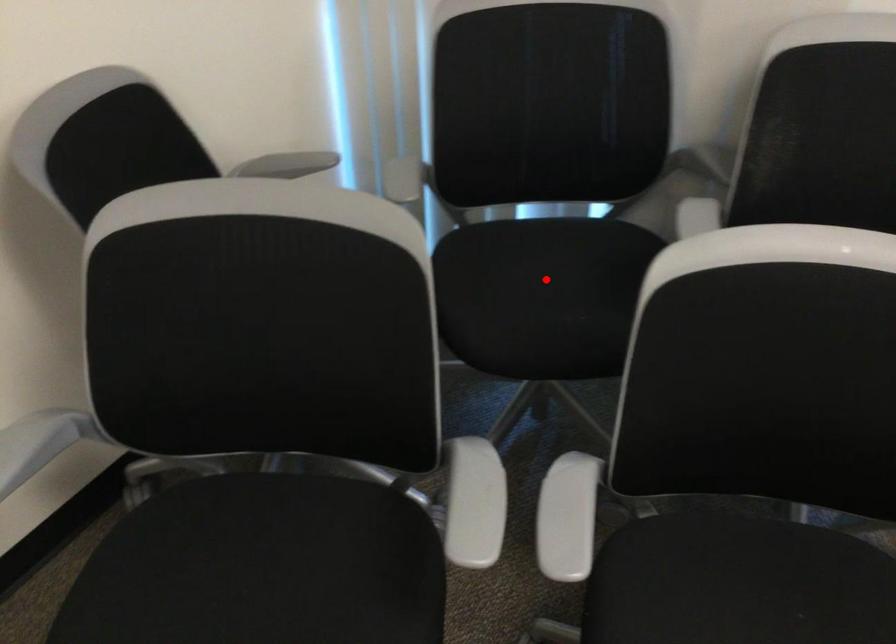
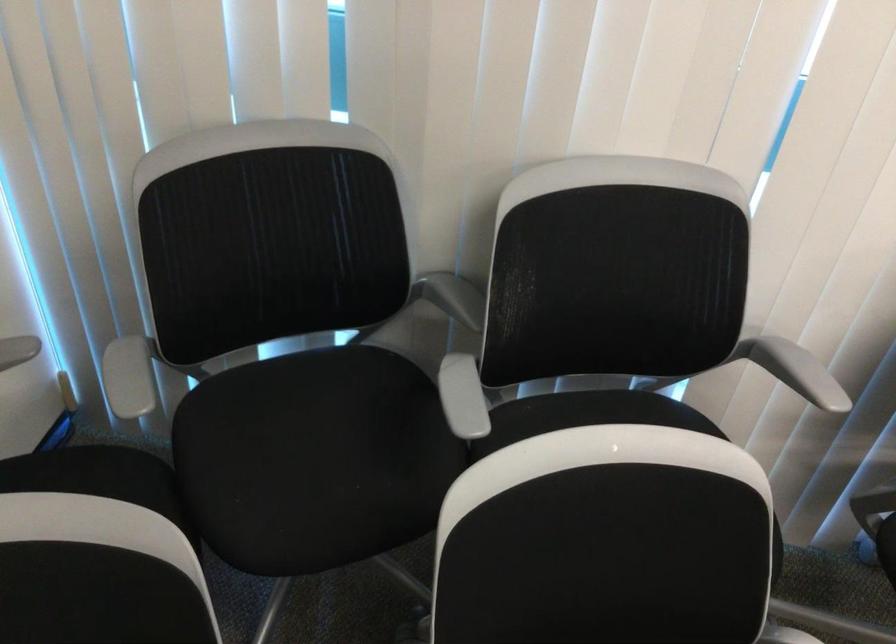
In the second image, find the point that corresponds to the highlighted location in the first image.

(312, 442)